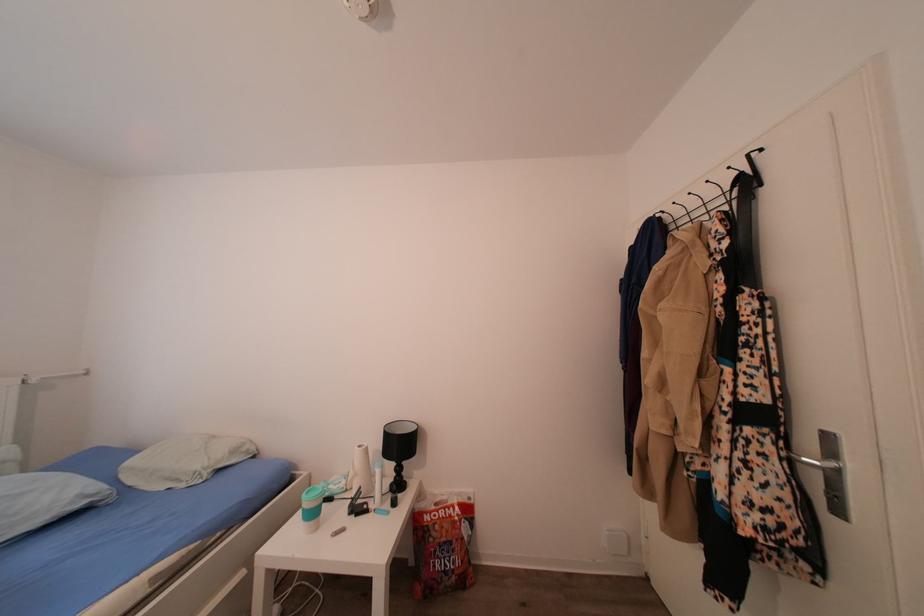
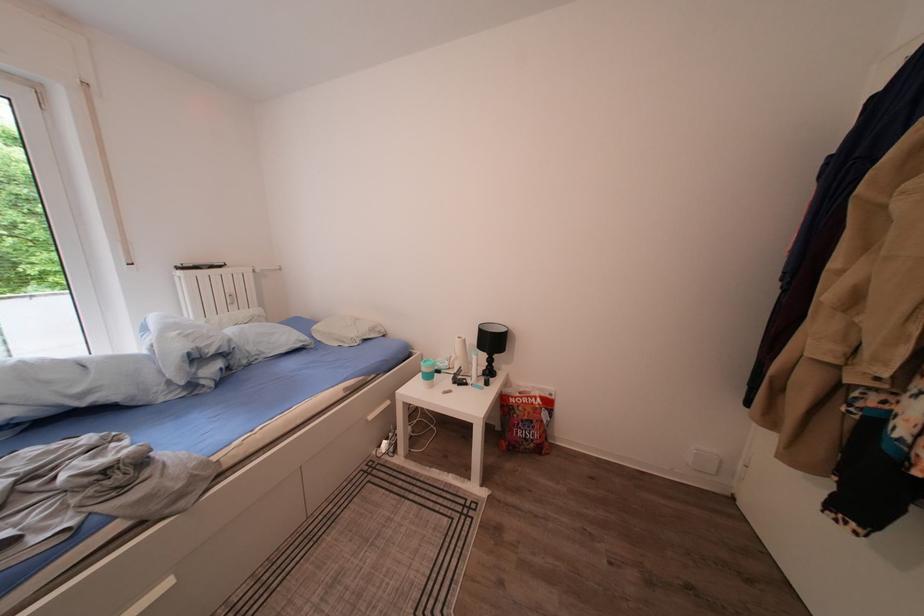
Where in the second image is the point corresponding to [363,480] from the first image?

(466, 363)